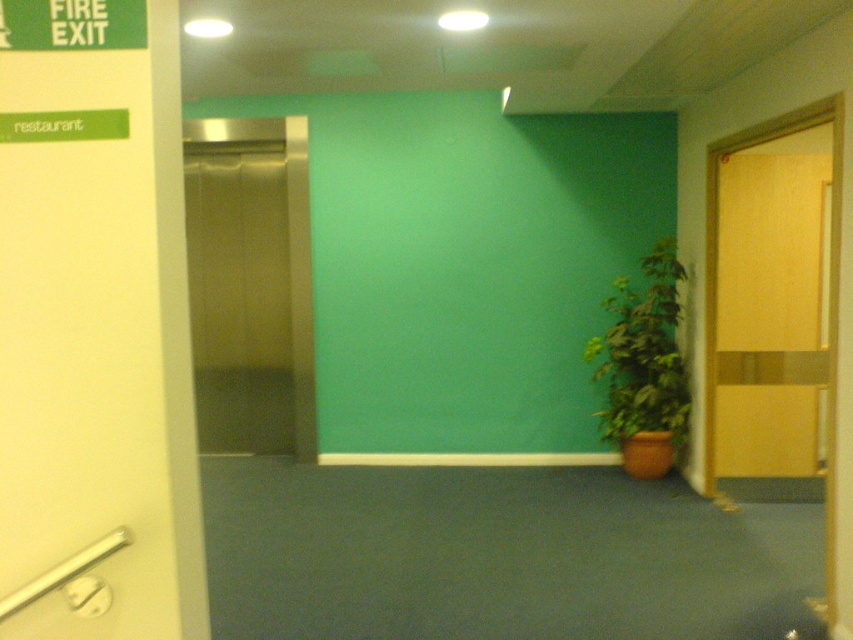
Does wooden at right have a greater width compared to green matte plant at right?

Yes, wooden at right is wider than green matte plant at right.

Does point (814, 164) come farther from viewer compared to point (631, 316)?

No, it is in front of (631, 316).

Where is `wooden at right`? This screenshot has width=853, height=640. wooden at right is located at coordinates (770, 308).

Can you confirm if stainless steel elevator at left is bigger than green matte plant at right?

Indeed, stainless steel elevator at left has a larger size compared to green matte plant at right.

Between point (270, 122) and point (650, 269), which one is positioned in front?

Positioned in front is point (650, 269).

You are a GUI agent. You are given a task and a screenshot of the screen. Output one action in this format:
    pyautogui.click(x=<x>, y=<y>)
    Task: Click on the stainless steel elevator at left
    The image size is (853, 640).
    Given the screenshot: What is the action you would take?
    pyautogui.click(x=250, y=284)

Does wooden at right appear on the left side of stainless steel elevator at left?

Incorrect, wooden at right is not on the left side of stainless steel elevator at left.

Can you confirm if wooden at right is positioned above stainless steel elevator at left?

No.

Which is behind, point (790, 269) or point (212, 144)?

The point (212, 144) is more distant.

At what (x,y) coordinates should I click in order to perform the action: click on wooden at right. Please return your answer as a coordinate pair (x, y). Looking at the image, I should click on (770, 308).